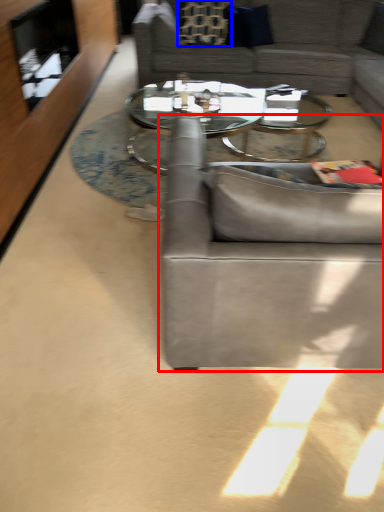
Question: Which of the following is the closest to the observer, studio couch (highlighted by a red box) or pillow (highlighted by a blue box)?

Choices:
 (A) studio couch
 (B) pillow

Answer: (A)